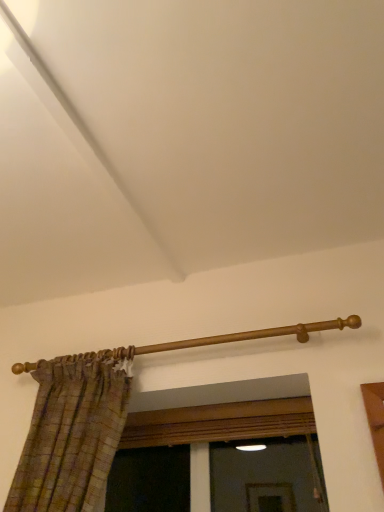
You are a GUI agent. You are given a task and a screenshot of the screen. Output one action in this format:
    pyautogui.click(x=<x>, y=<y>)
    Task: Click on the wooden curtain rod at upper center
    The width and height of the screenshot is (384, 512).
    Given the screenshot: What is the action you would take?
    pyautogui.click(x=196, y=343)

This screenshot has height=512, width=384. What do you see at coordinates (196, 343) in the screenshot?
I see `wooden curtain rod at upper center` at bounding box center [196, 343].

What do you see at coordinates (225, 426) in the screenshot? I see `wooden frame at center` at bounding box center [225, 426].

You are a GUI agent. You are given a task and a screenshot of the screen. Output one action in this format:
    pyautogui.click(x=<x>, y=<y>)
    Task: Click on the wooden frame at center
    Image resolution: width=384 pixels, height=512 pixels.
    Given the screenshot: What is the action you would take?
    pyautogui.click(x=225, y=426)

At what (x,y) coordinates should I click in order to perform the action: click on wooden curtain rod at upper center. Please return your answer as a coordinate pair (x, y). This screenshot has width=384, height=512. Looking at the image, I should click on (196, 343).

In the scene shown: Is wooden curtain rod at upper center to the left or to the right of wooden frame at center in the image?

From the image, it's evident that wooden curtain rod at upper center is to the left of wooden frame at center.

Is wooden curtain rod at upper center positioned behind wooden frame at center?

No, the depth of wooden curtain rod at upper center is less than that of wooden frame at center.

Which point is more forward, (16, 368) or (300, 401)?

Point (300, 401)

From the image's perspective, between wooden curtain rod at upper center and wooden frame at center, which one is located above?

wooden curtain rod at upper center.

From a real-world perspective, which object rests below the other?

wooden frame at center, from a real-world perspective.

Which object is wider, wooden curtain rod at upper center or wooden frame at center?

With larger width is wooden frame at center.

In terms of height, does wooden curtain rod at upper center look taller or shorter compared to wooden frame at center?

Considering their sizes, wooden curtain rod at upper center has less height than wooden frame at center.

Considering the sizes of objects wooden curtain rod at upper center and wooden frame at center in the image provided, who is smaller, wooden curtain rod at upper center or wooden frame at center?

Smaller between the two is wooden curtain rod at upper center.

Choose the correct answer: Is wooden curtain rod at upper center inside wooden frame at center or outside it?

wooden curtain rod at upper center cannot be found inside wooden frame at center.

Is wooden curtain rod at upper center not close to wooden frame at center?

Actually, wooden curtain rod at upper center and wooden frame at center are a little close together.

Does wooden curtain rod at upper center turn towards wooden frame at center?

No, wooden curtain rod at upper center is not facing towards wooden frame at center.

Where is `window on the right of wooden curtain rod at upper center`? window on the right of wooden curtain rod at upper center is located at coordinates (225, 426).

Is wooden frame at center to the left of wooden curtain rod at upper center from the viewer's perspective?

Incorrect, wooden frame at center is not on the left side of wooden curtain rod at upper center.

Is wooden frame at center positioned in front of wooden curtain rod at upper center?

No, wooden frame at center is behind wooden curtain rod at upper center.

Which point is more distant from viewer, (x=212, y=415) or (x=349, y=316)?

Positioned behind is point (x=212, y=415).

From the image's perspective, is wooden frame at center under wooden curtain rod at upper center?

Yes, from the image's perspective, wooden frame at center is beneath wooden curtain rod at upper center.

From a real-world perspective, is wooden frame at center above or below wooden curtain rod at upper center?

In terms of real-world spatial position, wooden frame at center is below wooden curtain rod at upper center.

Which of these two, wooden frame at center or wooden curtain rod at upper center, is thinner?

wooden curtain rod at upper center is thinner.

Which of these two, wooden frame at center or wooden curtain rod at upper center, stands taller?

wooden frame at center is taller.

Does wooden frame at center have a larger size compared to wooden curtain rod at upper center?

Indeed, wooden frame at center has a larger size compared to wooden curtain rod at upper center.

Is wooden frame at center outside of wooden curtain rod at upper center?

Indeed, wooden frame at center is completely outside wooden curtain rod at upper center.

Is wooden frame at center far away from wooden curtain rod at upper center?

No, wooden frame at center is not far from wooden curtain rod at upper center.

Could you tell me if wooden frame at center is turned towards wooden curtain rod at upper center?

No, wooden frame at center is not aimed at wooden curtain rod at upper center.

Find the location of `rail above the wooden frame at center (from a real-world perspective)`. rail above the wooden frame at center (from a real-world perspective) is located at coordinates (x=196, y=343).

The width and height of the screenshot is (384, 512). In order to click on window that is behind the wooden curtain rod at upper center in this screenshot , I will do `click(225, 426)`.

In the image, there is a wooden curtain rod at upper center. In order to click on window below it (from the image's perspective) in this screenshot , I will do `click(225, 426)`.